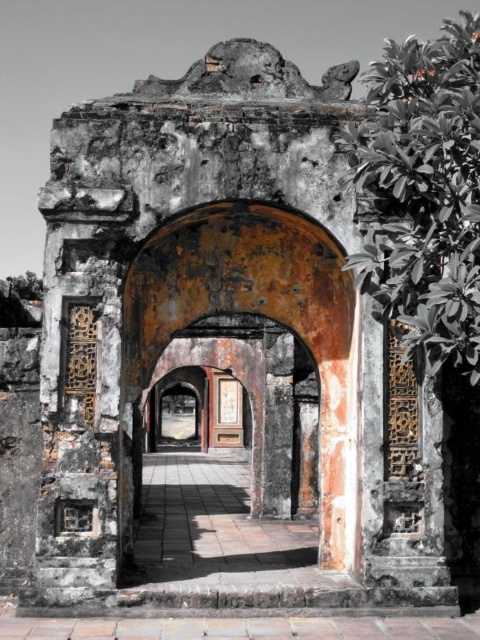
Question: Does green leafy plant at upper right have a smaller size compared to rusty metal archway at center?

Choices:
 (A) no
 (B) yes

Answer: (B)

Question: In this image, where is green leafy plant at upper right located relative to rusty metal archway at center?

Choices:
 (A) left
 (B) right

Answer: (B)

Question: Among these objects, which one is nearest to the camera?

Choices:
 (A) green leafy plant at upper right
 (B) rusty metal archway at center

Answer: (A)

Question: In this image, where is green leafy plant at upper right located relative to rusty metal archway at center?

Choices:
 (A) right
 (B) left

Answer: (A)